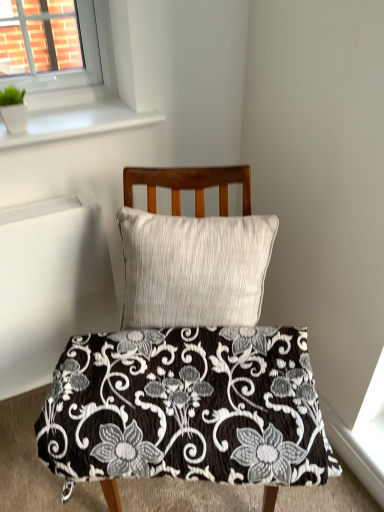
Image resolution: width=384 pixels, height=512 pixels. Describe the element at coordinates (194, 269) in the screenshot. I see `white textured pillow at center` at that location.

Locate an element on the screen. The height and width of the screenshot is (512, 384). black quilted cushion at center is located at coordinates (188, 360).

This screenshot has height=512, width=384. What do you see at coordinates (188, 360) in the screenshot?
I see `black quilted cushion at center` at bounding box center [188, 360].

The height and width of the screenshot is (512, 384). What are the coordinates of `white ceramic pot at upper left` in the screenshot? It's located at (13, 110).

Find the location of `white textured pillow at center`. white textured pillow at center is located at coordinates (194, 269).

Considering their positions, is white glossy window sill at upper left located in front of or behind white plastic window at upper left?

white glossy window sill at upper left is behind white plastic window at upper left.

Considering the sizes of white glossy window sill at upper left and white plastic window at upper left in the image, is white glossy window sill at upper left taller or shorter than white plastic window at upper left?

Considering their sizes, white glossy window sill at upper left has less height than white plastic window at upper left.

Between white glossy window sill at upper left and white plastic window at upper left, which one has larger size?

white plastic window at upper left.

Considering the positions of point (52, 126) and point (105, 3), is point (52, 126) closer or farther from the camera than point (105, 3)?

Clearly, point (52, 126) is closer to the camera than point (105, 3).

Is white ceramic pot at upper left wider or thinner than white plastic radiator at left?

In the image, white ceramic pot at upper left appears to be more narrow than white plastic radiator at left.

Which of these two, white ceramic pot at upper left or white plastic radiator at left, is bigger?

white plastic radiator at left is bigger.

Is white ceramic pot at upper left far from white plastic radiator at left?

No, white ceramic pot at upper left is not far away from white plastic radiator at left.

Is white ceramic pot at upper left turned away from white plastic radiator at left?

white ceramic pot at upper left does not have its back to white plastic radiator at left.

From the image's perspective, who appears lower, white ceramic pot at upper left or white textured pillow at center?

white textured pillow at center is shown below in the image.

You are a GUI agent. You are given a task and a screenshot of the screen. Output one action in this format:
    pyautogui.click(x=<x>, y=<y>)
    Task: Click on the pillow below the white ceramic pot at upper left (from a real-world perspective)
    The width and height of the screenshot is (384, 512).
    Given the screenshot: What is the action you would take?
    pyautogui.click(x=194, y=269)

Which of these two, white ceramic pot at upper left or white textured pillow at center, stands shorter?

With less height is white ceramic pot at upper left.

Is white ceramic pot at upper left looking in the opposite direction of white textured pillow at center?

No, white ceramic pot at upper left is not facing the opposite direction of white textured pillow at center.

Does white plastic radiator at left appear on the left side of black quilted cushion at center?

Correct, you'll find white plastic radiator at left to the left of black quilted cushion at center.

Is point (75, 241) farther from camera compared to point (174, 347)?

Yes, point (75, 241) is farther from viewer.

From the image's perspective, between white plastic radiator at left and black quilted cushion at center, which one is located above?

white plastic radiator at left is shown above in the image.

From a real-world perspective, is white glossy window sill at upper left above or below black quilted cushion at center?

Clearly, from a real-world perspective, white glossy window sill at upper left is above black quilted cushion at center.

Is white glossy window sill at upper left taller than black quilted cushion at center?

No.

Considering the sizes of objects white glossy window sill at upper left and black quilted cushion at center in the image provided, who is bigger, white glossy window sill at upper left or black quilted cushion at center?

Bigger between the two is black quilted cushion at center.

Can you confirm if white ceramic pot at upper left is taller than white glossy window sill at upper left?

Yes, white ceramic pot at upper left is taller than white glossy window sill at upper left.

In order to click on plant in front of the white glossy window sill at upper left in this screenshot , I will do `click(13, 110)`.

Measure the distance between white ceramic pot at upper left and white glossy window sill at upper left.

Answer: They are 5.06 inches apart.

Is point (4, 104) in front of point (110, 124)?

That is True.

Does point (141, 125) come behind point (229, 277)?

That is True.

Would you consider white glossy window sill at upper left to be distant from white textured pillow at center?

No.

From a real-world perspective, is white glossy window sill at upper left under white textured pillow at center?

Incorrect, from a real-world perspective, white glossy window sill at upper left is higher than white textured pillow at center.

Who is bigger, white glossy window sill at upper left or white textured pillow at center?

white textured pillow at center is bigger.

At what (x,y) coordinates should I click in order to perform the action: click on window sill that is behind the white plastic window at upper left. Please return your answer as a coordinate pair (x, y). The image size is (384, 512). Looking at the image, I should click on (76, 123).

Find the location of a particular element. radiator below the white ceramic pot at upper left (from a real-world perspective) is located at coordinates (50, 285).

Estimate the real-world distances between objects in this image. Which object is closer to white glossy window sill at upper left, black quilted cushion at center or white plastic window at upper left?

white plastic window at upper left lies closer to white glossy window sill at upper left than the other object.

Looking at the image, which one is located closer to black quilted fabric at center, white plastic radiator at left or black quilted cushion at center?

The object closer to black quilted fabric at center is black quilted cushion at center.

Looking at the image, which one is located closer to white glossy window sill at upper left, white ceramic pot at upper left or black quilted cushion at center?

Based on the image, white ceramic pot at upper left appears to be nearer to white glossy window sill at upper left.

When comparing their distances from white plastic window at upper left, does white textured pillow at center or white glossy window sill at upper left seem further?

white textured pillow at center lies further to white plastic window at upper left than the other object.

Estimate the real-world distances between objects in this image. Which object is further from white plastic window at upper left, black quilted fabric at center or white glossy window sill at upper left?

The object further to white plastic window at upper left is black quilted fabric at center.

When comparing their distances from white glossy window sill at upper left, does white plastic window at upper left or white plastic radiator at left seem further?

The object further to white glossy window sill at upper left is white plastic radiator at left.

Estimate the real-world distances between objects in this image. Which object is further from black quilted cushion at center, white plastic window at upper left or white textured pillow at center?

Among the two, white plastic window at upper left is located further to black quilted cushion at center.

From the image, which object appears to be farther from white ceramic pot at upper left, black quilted fabric at center or white plastic window at upper left?

Based on the image, black quilted fabric at center appears to be further to white ceramic pot at upper left.

What are the coordinates of `pillow situated between white plastic radiator at left and black quilted fabric at center from left to right` in the screenshot? It's located at click(194, 269).

I want to click on pillow between white ceramic pot at upper left and black quilted fabric at center from top to bottom, so click(x=194, y=269).

The width and height of the screenshot is (384, 512). In order to click on radiator that lies between white ceramic pot at upper left and black quilted cushion at center from top to bottom in this screenshot , I will do pyautogui.click(x=50, y=285).

Image resolution: width=384 pixels, height=512 pixels. I want to click on pillow that lies between white glossy window sill at upper left and black quilted cushion at center from top to bottom, so click(194, 269).